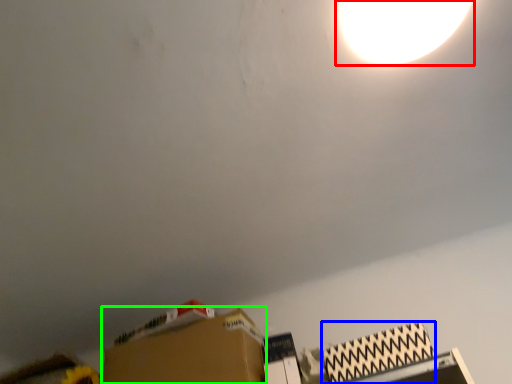
Question: Estimate the real-world distances between objects in this image. Which object is farther from lamp (highlighted by a red box), cardboard box (highlighted by a blue box) or cardboard box (highlighted by a green box)?

Choices:
 (A) cardboard box
 (B) cardboard box

Answer: (B)